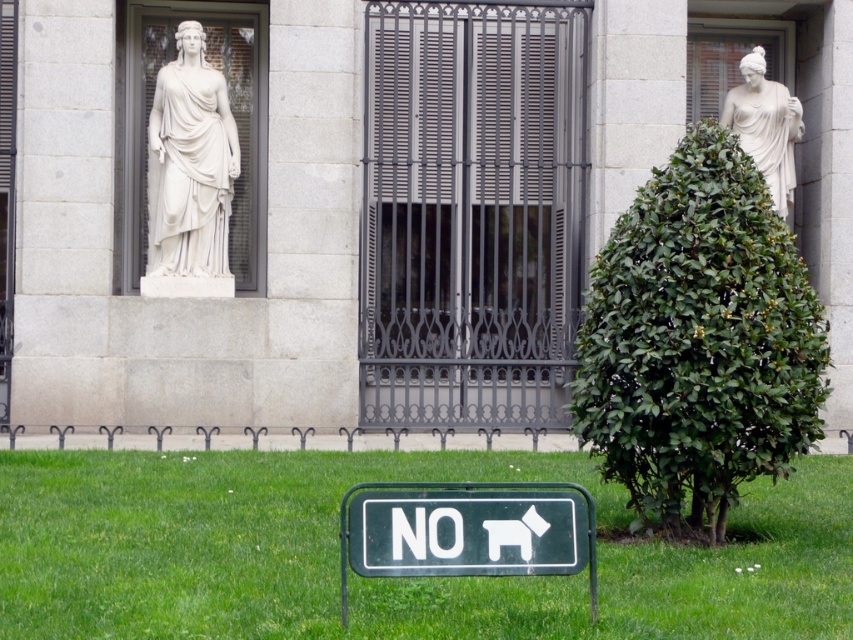
Is white marble statue at left wider than white marble statue at upper right?

Yes, white marble statue at left is wider than white marble statue at upper right.

Is white marble statue at left shorter than white marble statue at upper right?

Incorrect, white marble statue at left's height does not fall short of white marble statue at upper right's.

The image size is (853, 640). What are the coordinates of `white marble statue at left` in the screenshot? It's located at (189, 164).

Does green plastic sign at center have a larger size compared to white marble statue at left?

No.

Between point (540, 550) and point (189, 36), which one is positioned behind?

Positioned behind is point (189, 36).

Find the location of a particular element. green plastic sign at center is located at coordinates (467, 531).

The height and width of the screenshot is (640, 853). What do you see at coordinates (699, 339) in the screenshot? I see `green leafy bush at right` at bounding box center [699, 339].

Between green leafy bush at right and white marble statue at left, which one has more height?

white marble statue at left

Identify the location of green leafy bush at right. Image resolution: width=853 pixels, height=640 pixels. (699, 339).